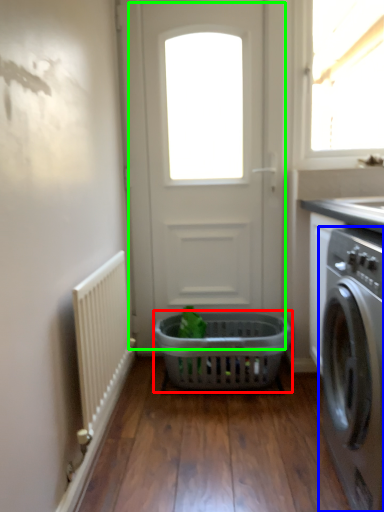
Question: Which object is the farthest from basket (highlighted by a red box)? Choose among these: washing machine (highlighted by a blue box) or door (highlighted by a green box).

Choices:
 (A) washing machine
 (B) door

Answer: (A)